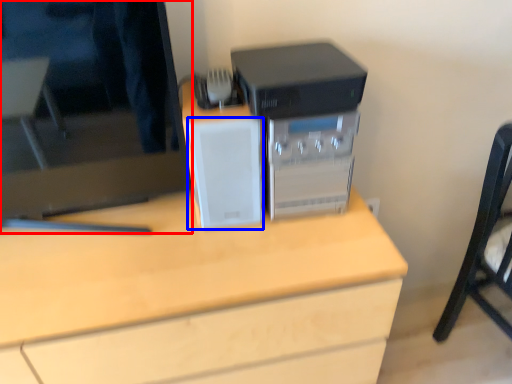
Question: Which point is closer to the camera, computer monitor (highlighted by a red box) or speaker (highlighted by a blue box)?

Choices:
 (A) computer monitor
 (B) speaker

Answer: (A)